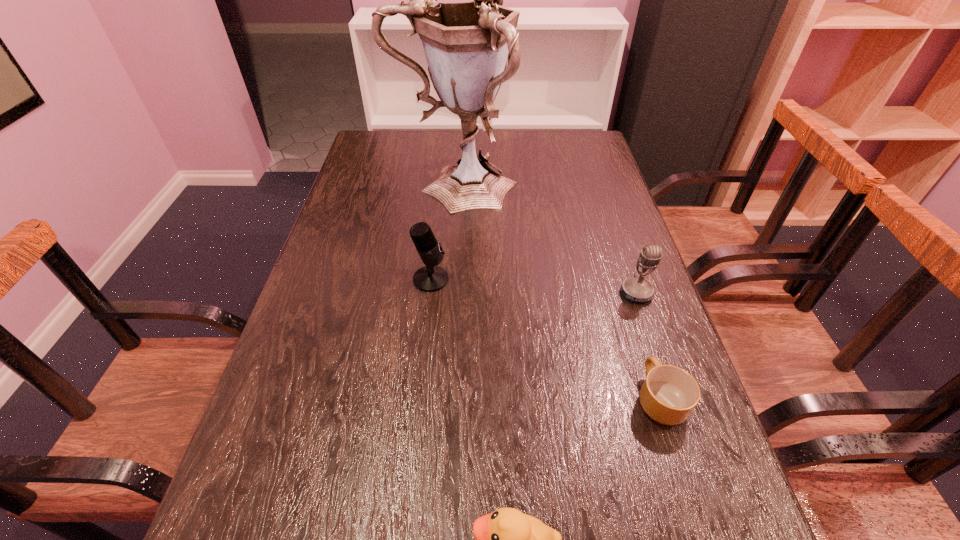
Locate an element on the screen. vacant area that lies between the left microphone and the shortest object is located at coordinates (545, 339).

Where is `unoccupied area between the shortest object and the right microphone`? unoccupied area between the shortest object and the right microphone is located at coordinates (648, 346).

At what (x,y) coordinates should I click in order to perform the action: click on free area in between the tallest object and the left microphone. Please return your answer as a coordinate pair (x, y). This screenshot has width=960, height=540. Looking at the image, I should click on (444, 233).

You are a GUI agent. You are given a task and a screenshot of the screen. Output one action in this format:
    pyautogui.click(x=<x>, y=<y>)
    Task: Click on the free point between the left microphone and the second nearest object
    
    Given the screenshot: What is the action you would take?
    pyautogui.click(x=545, y=339)

Locate which object ranks third in proximity to the nearest object. Please provide its 2D coordinates. Your answer should be formatted as a tuple, i.e. [(x, y)], where the tuple contains the x and y coordinates of a point satisfying the conditions above.

[(635, 289)]

This screenshot has width=960, height=540. What are the coordinates of `the fourth closest object to the left microphone` in the screenshot? It's located at (506, 539).

Find the location of `free space that satisfies the following two spatial constraints: 1. on the stand of the left microphone; 2. on the side with the handle of the second nearest object`. free space that satisfies the following two spatial constraints: 1. on the stand of the left microphone; 2. on the side with the handle of the second nearest object is located at coordinates (418, 399).